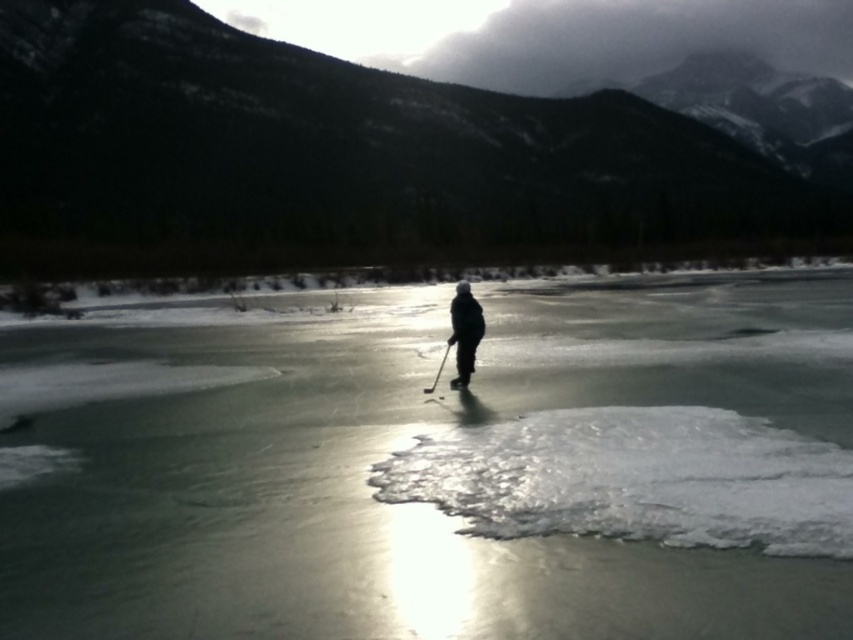
You are a hiker trying to cross the frozen lake in the winter scene. The ice is uneven and has patches of snow and open water. There is a transparent ice at center. Where exactly is the transparent ice located in relation to the hiker?

The transparent ice at center is located at point 0.727 on the x axis and 0.510 on the y axis relative to the hiker.

You are planning to cross the frozen lake in the winter scene. There is a black matte jacket at center located at point (463, 332). Is the location safe to walk on?

The black matte jacket at center is located at point (463, 332). The description mentions the ice surface is uneven with patches of snow and open water, indicating potential thin ice areas. Since the jacket is at the center, which may correspond to thinner ice where open water is present, it might not be safe. However, without specific ice thickness data at that exact point, it is uncertain. Proceed with caution and check ice stability before walking there.